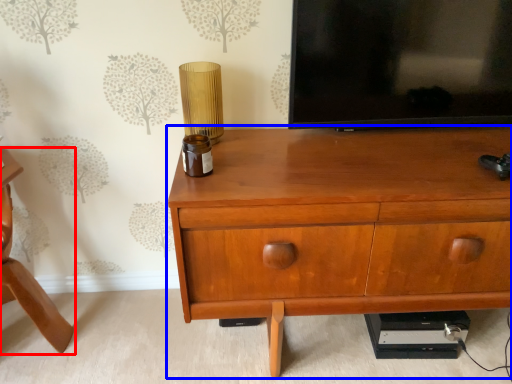
Question: Which of the following is the closest to the observer, furniture (highlighted by a red box) or chest of drawers (highlighted by a blue box)?

Choices:
 (A) furniture
 (B) chest of drawers

Answer: (B)